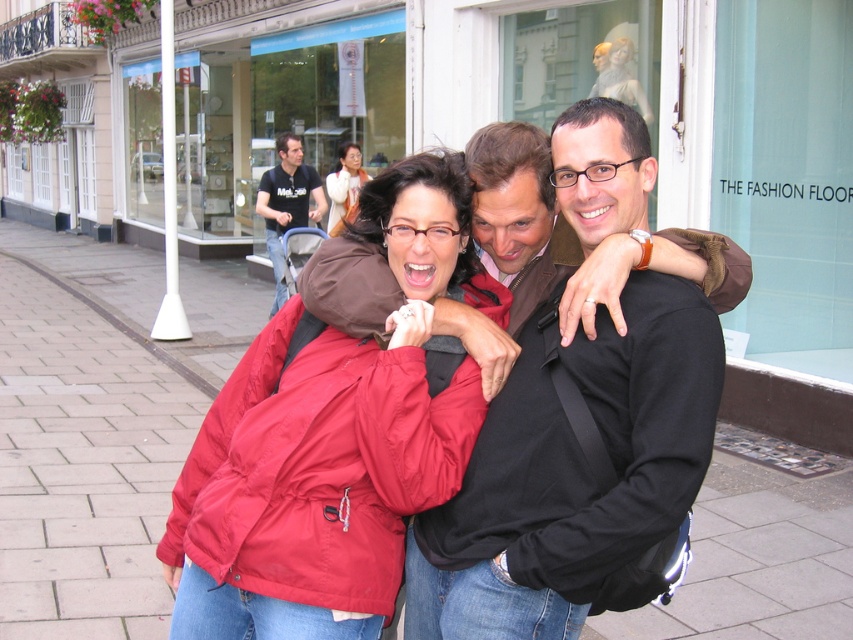
You are a delivery person carrying a large box that is 2 meters wide. You need to walk through the area shown in the scene. Can you fit through the space between the paved stone sidewalk at center and the matte red jacket at center without the box hitting anything?

The paved stone sidewalk at center has a larger size compared to the matte red jacket at center, so the space between them is sufficient for a 2 meter wide box to pass through without hitting anything.

You are standing at the point marked as point (332, 442) in the image. What object is located exactly at that point?

The matte red jacket at center is located exactly at point (332, 442).

You are a delivery person carrying a box that is 1.2 meters wide. You need to walk along the paved stone sidewalk at center while avoiding stepping on the matte red jacket at center. Is the sidewalk wide enough for you to pass safely without touching the jacket?

The paved stone sidewalk at center is wider than the matte red jacket at center, so yes, the sidewalk is wide enough for the delivery person to pass safely without touching the jacket.